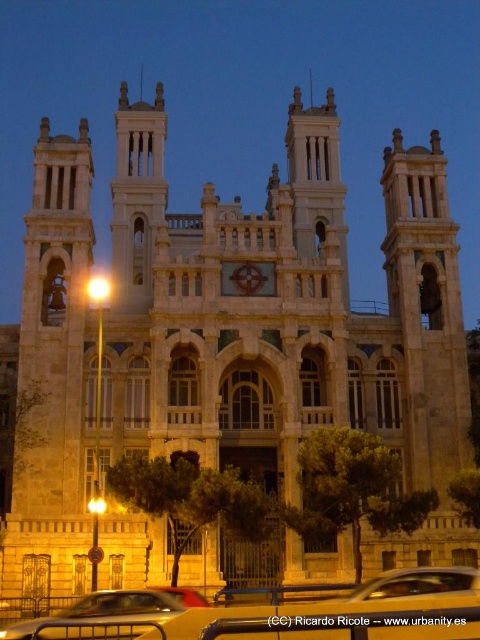
Question: Among these points, which one is nearest to the camera?

Choices:
 (A) (432, 636)
 (B) (24, 634)

Answer: (A)

Question: Is metallic silver car at center further to camera compared to metallic silver car at lower center?

Choices:
 (A) no
 (B) yes

Answer: (A)

Question: Is metallic silver car at center below metallic silver car at lower center?

Choices:
 (A) no
 (B) yes

Answer: (A)

Question: Can you confirm if metallic silver car at center is positioned below metallic silver car at lower center?

Choices:
 (A) no
 (B) yes

Answer: (A)